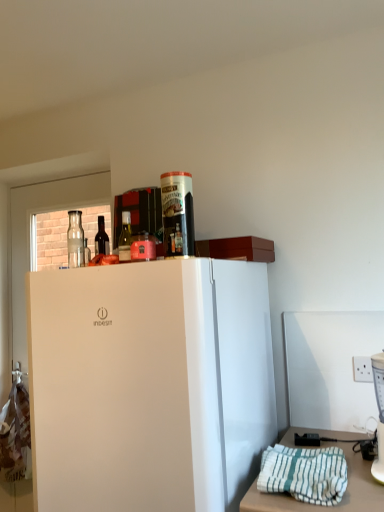
Question: Should I look upward or downward to see white plastic blender at right?

Choices:
 (A) down
 (B) up

Answer: (A)

Question: Can you confirm if white matte refrigerator at center is shorter than white plastic blender at right?

Choices:
 (A) yes
 (B) no

Answer: (B)

Question: Can white plastic blender at right be found inside white matte refrigerator at center?

Choices:
 (A) no
 (B) yes

Answer: (A)

Question: Does white matte refrigerator at center have a larger size compared to white plastic blender at right?

Choices:
 (A) yes
 (B) no

Answer: (A)

Question: Can you confirm if white matte refrigerator at center is wider than white plastic blender at right?

Choices:
 (A) yes
 (B) no

Answer: (A)

Question: Does white matte refrigerator at center appear on the right side of white plastic blender at right?

Choices:
 (A) no
 (B) yes

Answer: (A)

Question: From a real-world perspective, is white matte refrigerator at center positioned over white plastic blender at right based on gravity?

Choices:
 (A) yes
 (B) no

Answer: (B)

Question: Is white matte refrigerator at center shorter than dark glass bottle at upper left, acting as the 1th bottle starting from the back?

Choices:
 (A) yes
 (B) no

Answer: (B)

Question: Considering the relative positions of white matte refrigerator at center and dark glass bottle at upper left, arranged as the 1th bottle when viewed from the left, in the image provided, is white matte refrigerator at center to the left of dark glass bottle at upper left, arranged as the 1th bottle when viewed from the left, from the viewer's perspective?

Choices:
 (A) yes
 (B) no

Answer: (B)

Question: Is white matte refrigerator at center oriented away from dark glass bottle at upper left, arranged as the 1th bottle when viewed from the left?

Choices:
 (A) no
 (B) yes

Answer: (A)

Question: From a real-world perspective, is white matte refrigerator at center positioned under dark glass bottle at upper left, acting as the 1th bottle starting from the back, based on gravity?

Choices:
 (A) no
 (B) yes

Answer: (B)

Question: Is white matte refrigerator at center bigger than dark glass bottle at upper left, positioned as the 2th bottle in right-to-left order?

Choices:
 (A) no
 (B) yes

Answer: (B)

Question: Considering the relative sizes of white matte refrigerator at center and dark glass bottle at upper left, arranged as the 1th bottle when viewed from the left, in the image provided, is white matte refrigerator at center taller than dark glass bottle at upper left, arranged as the 1th bottle when viewed from the left,?

Choices:
 (A) yes
 (B) no

Answer: (A)

Question: Is matte glass bottle at upper center, which is counted as the second bottle, starting from the left, far from white striped towel at lower right?

Choices:
 (A) yes
 (B) no

Answer: (B)